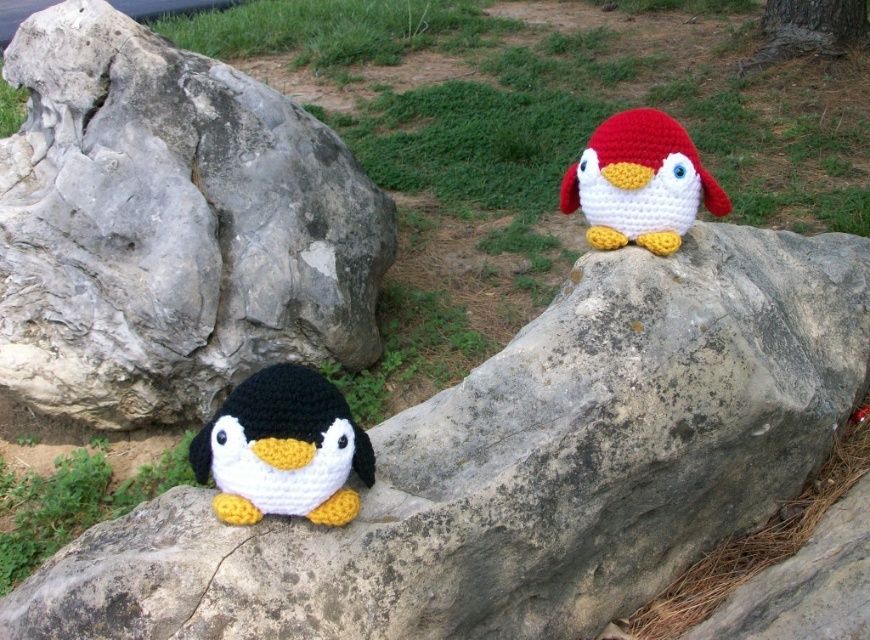
You are a bird flying over the rock formation and want to land on the closest penguin. Which penguin should you choose between the black yarn penguin at lower left and the red yarn penguin at upper right?

The black yarn penguin at lower left is below the red yarn penguin at upper right, so the black yarn penguin at lower left is closer to the ground and thus the bird should land there.

You are an outdoor sculptor who wants to place a new sculpture between the gray rough rock at center and the gray rough boulder at lower left. Given their sizes, which one should you position the sculpture closer to to ensure it doesn t get overshadowed?

The gray rough rock at center is larger in size than the gray rough boulder at lower left, so positioning the sculpture closer to the gray rough boulder at lower left would prevent it from being overshadowed by the larger rock.

You are standing in front of the image and want to locate the gray rough boulder at lower left. According to the coordinate system where the bottom left corner is the origin, what are its coordinates?

The gray rough boulder at lower left is located at the 2D coordinates of point (171,227).